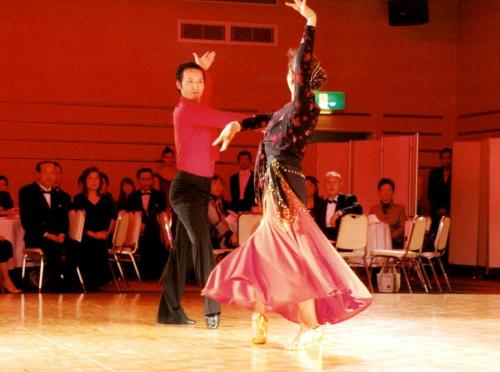
The height and width of the screenshot is (372, 500). Find the location of `neon sign`. neon sign is located at coordinates (325, 100).